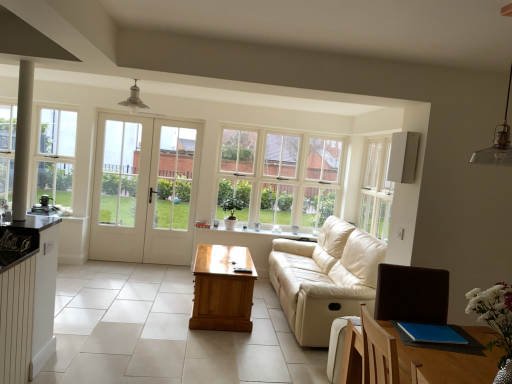
Question: Should I look upward or downward to see light brown wooden table at center?

Choices:
 (A) down
 (B) up

Answer: (A)

Question: Is clear glass window at center, which is the first window from right to left, closer to camera compared to light brown wooden table at center?

Choices:
 (A) yes
 (B) no

Answer: (B)

Question: From the image's perspective, is clear glass window at center, which is the first window from right to left, above light brown wooden table at center?

Choices:
 (A) no
 (B) yes

Answer: (B)

Question: Is there a large distance between clear glass window at center, arranged as the second window when viewed from the left, and light brown wooden table at center?

Choices:
 (A) no
 (B) yes

Answer: (B)

Question: Is clear glass window at center, arranged as the second window when viewed from the front, to the right of light brown wooden table at center from the viewer's perspective?

Choices:
 (A) yes
 (B) no

Answer: (A)

Question: Is clear glass window at center, which is the first window from right to left, not within light brown wooden table at center?

Choices:
 (A) no
 (B) yes

Answer: (B)

Question: Are clear glass window at center, which ranks as the first window in back-to-front order, and light brown wooden table at center beside each other?

Choices:
 (A) yes
 (B) no

Answer: (B)

Question: Is beige leather couch at center oriented away from clear glass window at left, marked as the first window in a front-to-back arrangement?

Choices:
 (A) no
 (B) yes

Answer: (A)

Question: Does beige leather couch at center appear on the left side of clear glass window at left, which appears as the 2th window when viewed from the back?

Choices:
 (A) yes
 (B) no

Answer: (B)

Question: Can you confirm if beige leather couch at center is shorter than clear glass window at left, the first window viewed from the left?

Choices:
 (A) no
 (B) yes

Answer: (B)

Question: From the image's perspective, is beige leather couch at center above clear glass window at left, which appears as the 2th window when viewed from the back?

Choices:
 (A) no
 (B) yes

Answer: (A)

Question: Can you confirm if beige leather couch at center is positioned to the right of clear glass window at left, marked as the first window in a front-to-back arrangement?

Choices:
 (A) no
 (B) yes

Answer: (B)

Question: Does beige leather couch at center lie in front of clear glass window at left, which ranks as the 2th window in right-to-left order?

Choices:
 (A) yes
 (B) no

Answer: (A)

Question: Considering the relative sizes of white glass door at center and matte black coffee machine at left, which is the 2th appliance from top to bottom, in the image provided, is white glass door at center thinner than matte black coffee machine at left, which is the 2th appliance from top to bottom,?

Choices:
 (A) no
 (B) yes

Answer: (B)